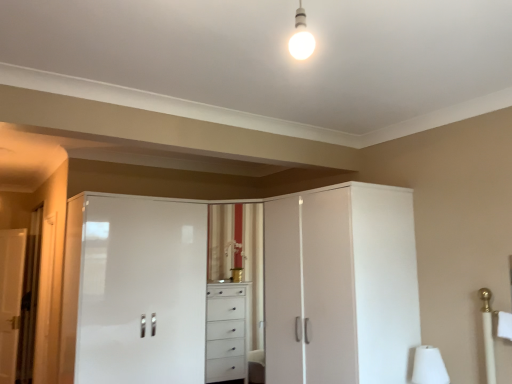
Question: In terms of width, does white glossy door at left look wider or thinner when compared to white glossy cabinet at center, which is the first screen door from right to left?

Choices:
 (A) wide
 (B) thin

Answer: (B)

Question: Relative to white glossy cabinet at center, which is the first screen door from right to left, is white glossy door at left in front or behind?

Choices:
 (A) front
 (B) behind

Answer: (B)

Question: Based on their relative distances, which object is farther from the white glossy cabinet at center, the second screen door positioned from the left?

Choices:
 (A) white matte table lamp at lower right
 (B) white glossy cabinet at center, acting as the second screen door starting from the right
 (C) white glossy door at left

Answer: (C)

Question: Which of these objects is positioned farthest from the white glossy cabinet at center, the 1th screen door viewed from the left?

Choices:
 (A) white glossy door at left
 (B) white matte table lamp at lower right
 (C) white glossy cabinet at center, the second screen door positioned from the left

Answer: (A)